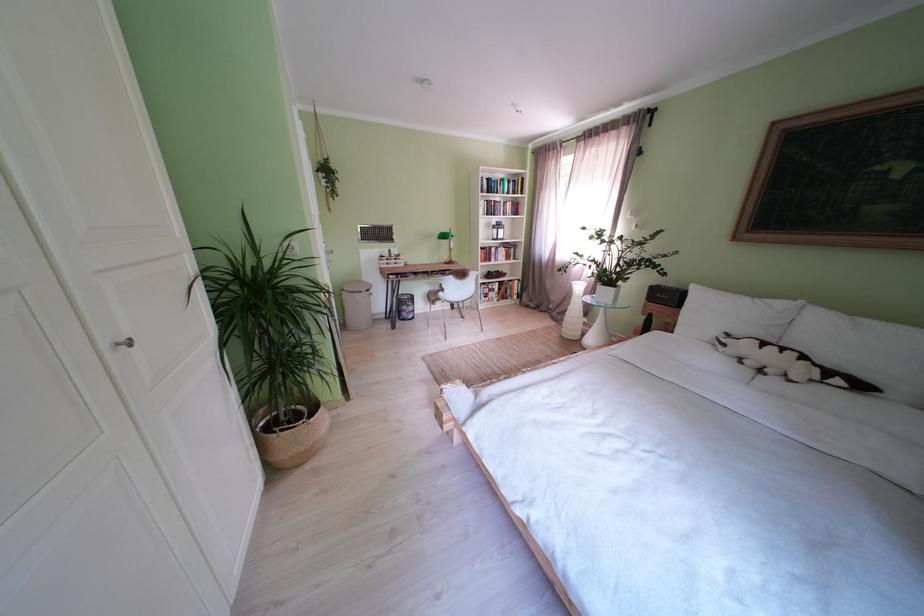
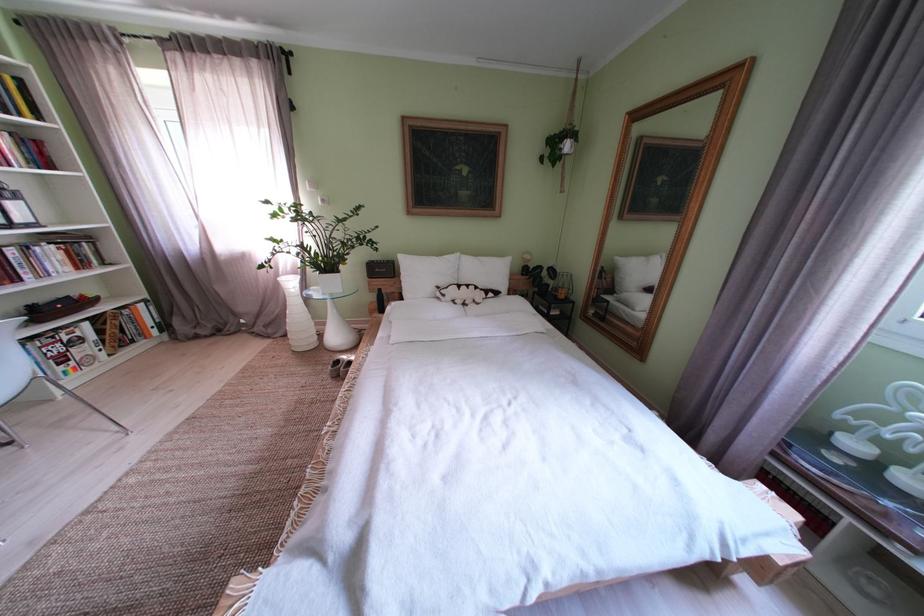
Locate, in the second image, the point that corresponds to point (716, 317) in the first image.

(429, 280)